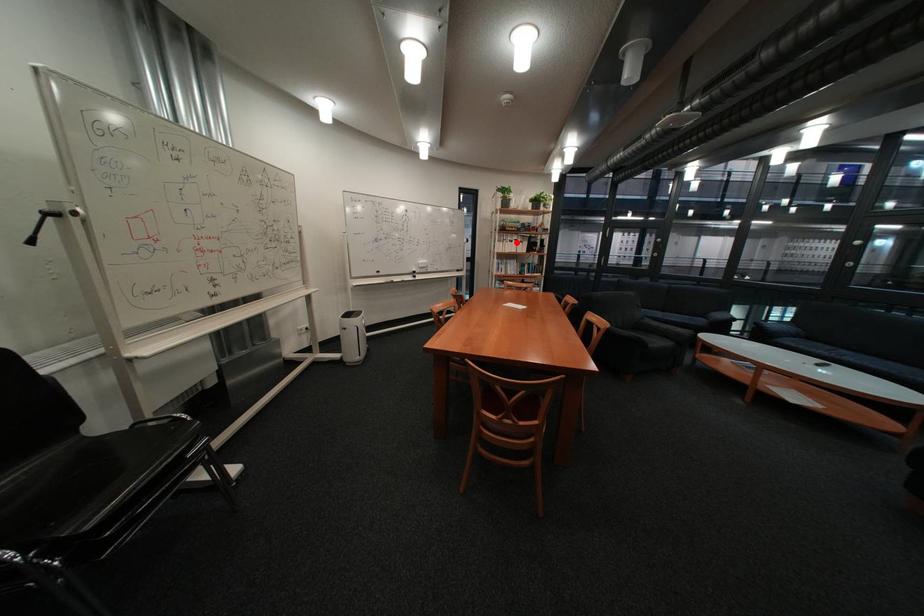
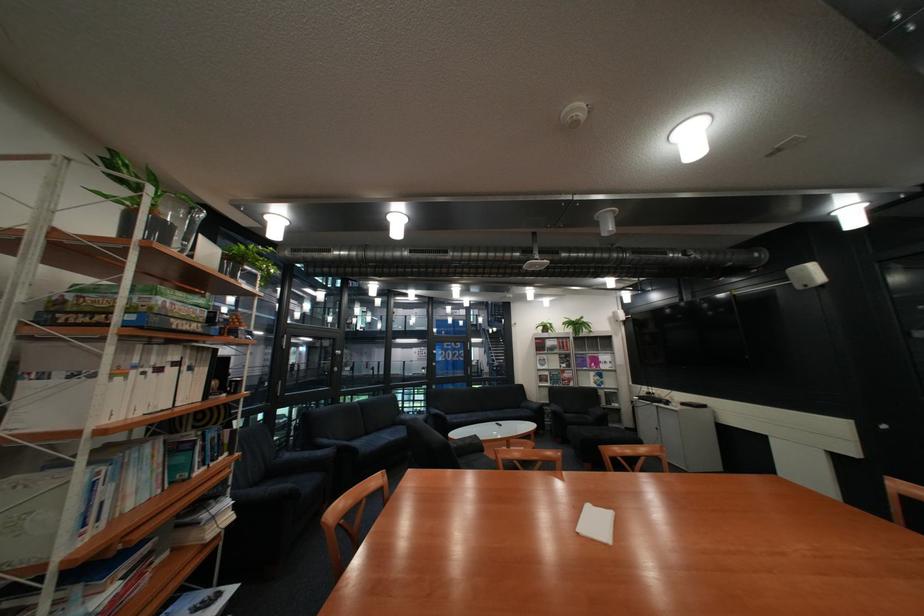
Where in the second image is the point corresponding to the highlighted location from the first image?

(134, 379)